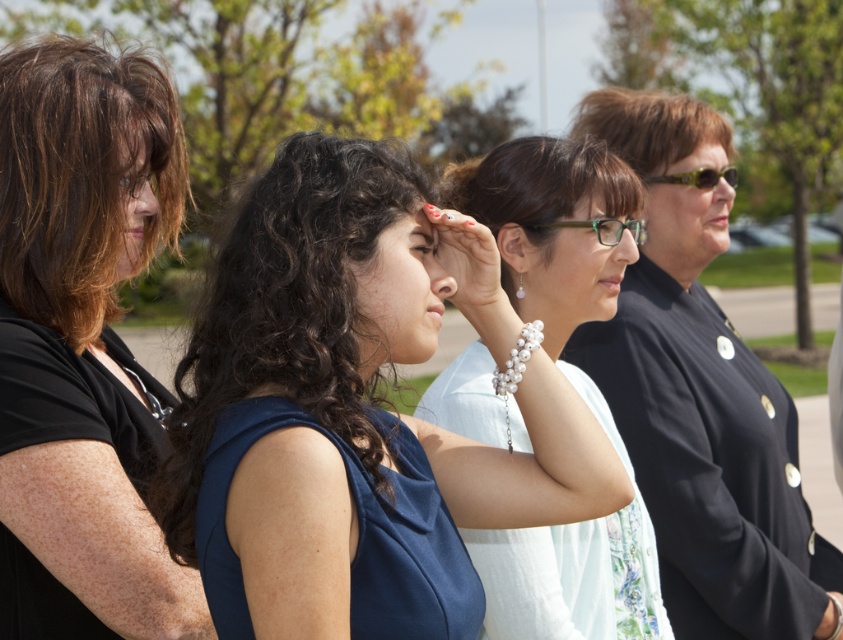
Question: Based on their relative distances, which object is nearer to the matte black hair at upper right?

Choices:
 (A) green plastic glasses at center
 (B) dark blue fabric dress at left
 (C) matte black shirt at left

Answer: (A)

Question: Is dark blue fabric dress at left above yellow-green plastic sunglasses at right?

Choices:
 (A) no
 (B) yes

Answer: (A)

Question: Which object is the closest to the matte blue dress at center?

Choices:
 (A) white pearl bracelet at center
 (B) yellow-green plastic sunglasses at right
 (C) dark blue fabric dress at left
 (D) matte black forehead at upper center

Answer: (A)

Question: Does dark blue fabric dress at left have a larger size compared to yellow-green plastic sunglasses at right?

Choices:
 (A) no
 (B) yes

Answer: (B)

Question: Does matte blue dress at center appear under dark blue fabric dress at left?

Choices:
 (A) no
 (B) yes

Answer: (B)

Question: Which object appears farthest from the camera in this image?

Choices:
 (A) matte black forehead at upper center
 (B) green plastic glasses at center

Answer: (A)